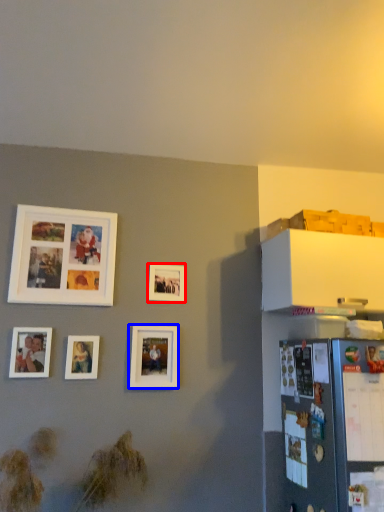
Question: Which object appears closest to the camera in this image, picture frame (highlighted by a red box) or picture frame (highlighted by a blue box)?

Choices:
 (A) picture frame
 (B) picture frame

Answer: (B)